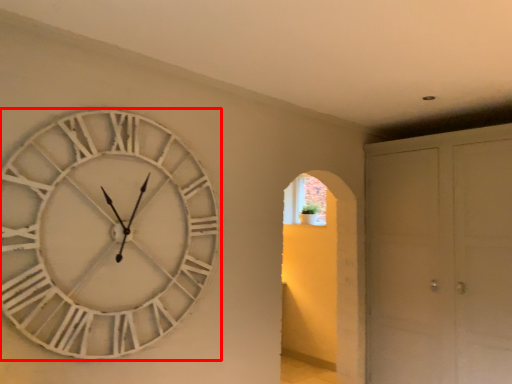
Question: Where is wall clock (annotated by the red box) located in relation to glass door in the image?

Choices:
 (A) left
 (B) right

Answer: (A)